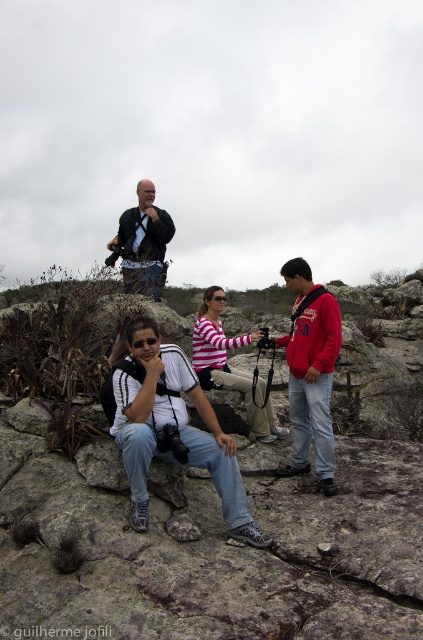
Between rough stone rock at center and red fleece jacket at center, which one appears on the left side from the viewer's perspective?

From the viewer's perspective, rough stone rock at center appears more on the left side.

What do you see at coordinates (206, 541) in the screenshot? I see `rough stone rock at center` at bounding box center [206, 541].

Is point (217, 508) positioned behind point (324, 332)?

No, it is not.

Where is `rough stone rock at center`? rough stone rock at center is located at coordinates (206, 541).

Does white matte shirt at center have a larger size compared to red fleece jacket at center?

Incorrect, white matte shirt at center is not larger than red fleece jacket at center.

In the scene shown: Is white matte shirt at center smaller than red fleece jacket at center?

Yes.

Is point (186, 422) positioned in front of point (307, 269)?

Yes, point (186, 422) is closer to viewer.

Locate an element on the screen. The height and width of the screenshot is (640, 423). white matte shirt at center is located at coordinates (173, 428).

Is point (318, 525) closer to camera compared to point (137, 228)?

Yes, it is.

Describe the element at coordinates (206, 541) in the screenshot. I see `rough stone rock at center` at that location.

Between point (13, 433) and point (115, 240), which one is positioned in front?

Point (13, 433) is in front.

Where is `rough stone rock at center`? rough stone rock at center is located at coordinates (206, 541).